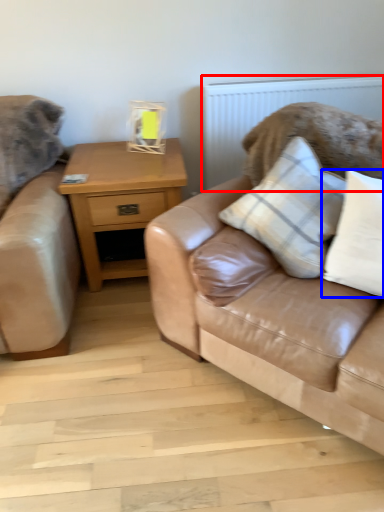
Question: Which point is further to the camera, radiator (highlighted by a red box) or pillow (highlighted by a blue box)?

Choices:
 (A) radiator
 (B) pillow

Answer: (A)